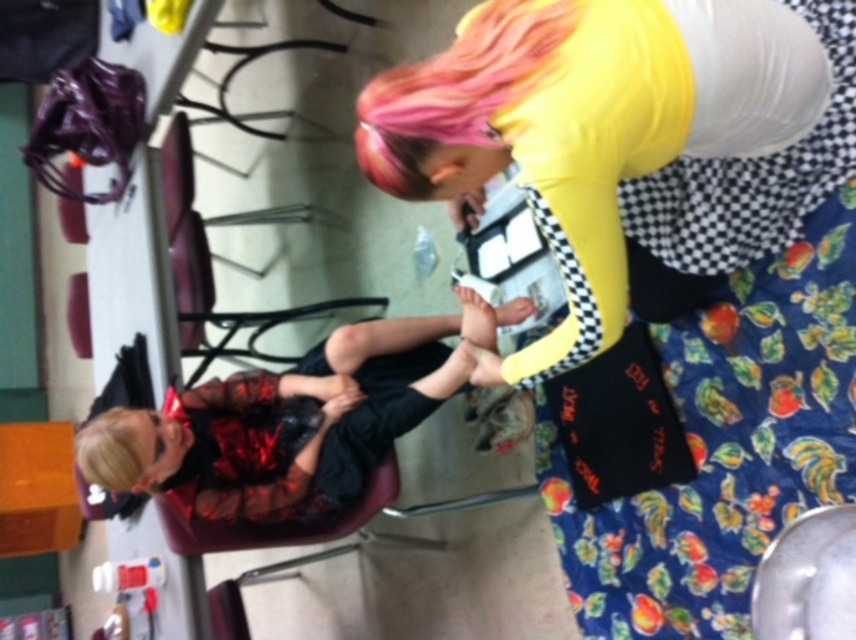
You are a customer entering a salon and see the shiny black dress at lower left and the pink dyed hair at upper center in the image. Which object is positioned higher from the ground?

The pink dyed hair at upper center is positioned higher from the ground than the shiny black dress at lower left.

You are a photographer taking a picture of the shiny black dress at lower left and the pink dyed hair at upper center. Which object is closer to the camera?

The shiny black dress at lower left is closer to the camera than the pink dyed hair at upper center because it is further to the viewer.